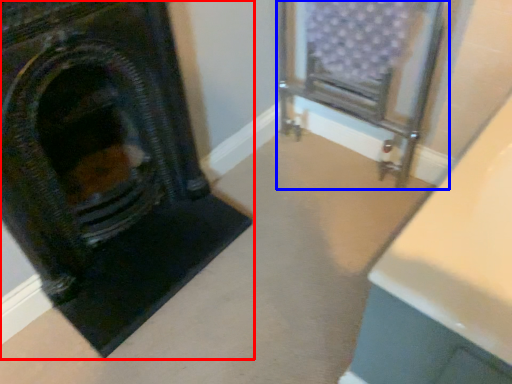
Question: Which object appears closest to the camera in this image, fireplace (highlighted by a red box) or furniture (highlighted by a blue box)?

Choices:
 (A) fireplace
 (B) furniture

Answer: (A)